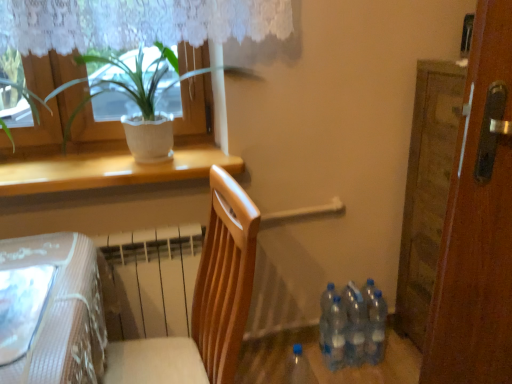
Where is `vacant space underneath green leafy plant at upper left (from a real-world perspective)`? vacant space underneath green leafy plant at upper left (from a real-world perspective) is located at coordinates (160, 161).